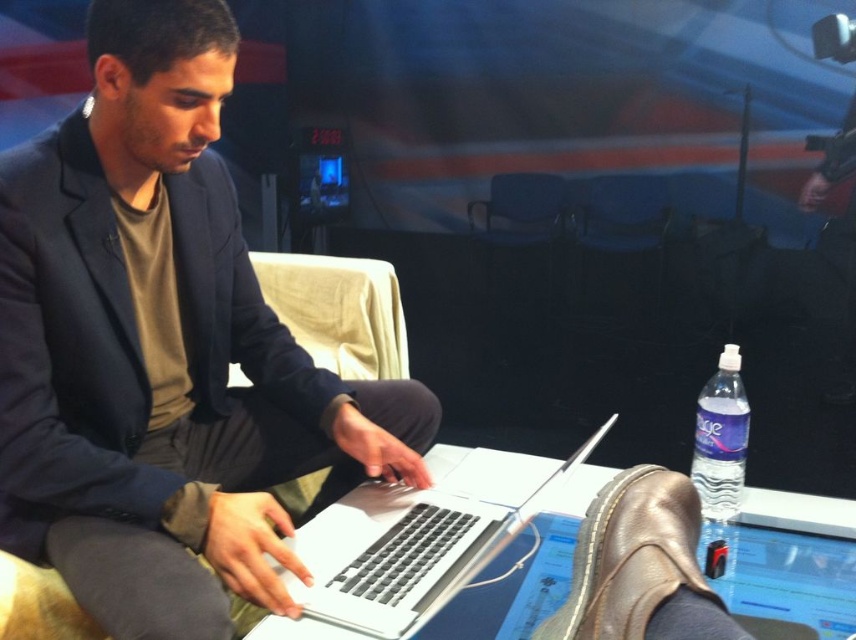
Question: Among these points, which one is nearest to the camera?

Choices:
 (A) (397, 564)
 (B) (651, 188)
 (C) (699, 493)
 (D) (113, 516)

Answer: (A)

Question: Is matte black laptop at center wider than blue fabric armchair at center?

Choices:
 (A) no
 (B) yes

Answer: (B)

Question: Considering the relative positions of matte black laptop at center and silver metallic laptop at center in the image provided, where is matte black laptop at center located with respect to silver metallic laptop at center?

Choices:
 (A) right
 (B) left

Answer: (B)

Question: Among these points, which one is nearest to the camera?

Choices:
 (A) (580, 301)
 (B) (220, 216)
 (C) (738, 499)
 (D) (312, 547)

Answer: (D)

Question: Can you confirm if blue fabric armchair at center is positioned to the left of clear plastic water bottle at lower right?

Choices:
 (A) no
 (B) yes

Answer: (A)

Question: Which point is closer to the camera?

Choices:
 (A) blue fabric armchair at center
 (B) silver metallic laptop at center
 (C) clear plastic water bottle at lower right

Answer: (B)